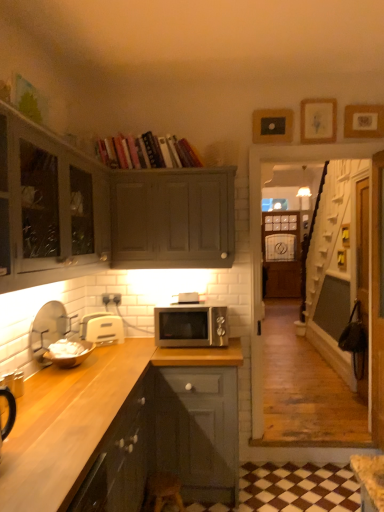
Question: Does silver metallic microwave at center, which is the first appliance from right to left, have a smaller size compared to wooden picture frame at upper center, which is counted as the 2th picture frame, starting from the right?

Choices:
 (A) yes
 (B) no

Answer: (B)

Question: Considering the relative sizes of silver metallic microwave at center, the fourth appliance in the left-to-right sequence, and wooden picture frame at upper center, which appears as the second picture frame when viewed from the left, in the image provided, is silver metallic microwave at center, the fourth appliance in the left-to-right sequence, wider than wooden picture frame at upper center, which appears as the second picture frame when viewed from the left,?

Choices:
 (A) no
 (B) yes

Answer: (B)

Question: Considering the relative sizes of silver metallic microwave at center, which is the first appliance from right to left, and wooden picture frame at upper center, which is counted as the 2th picture frame, starting from the right, in the image provided, is silver metallic microwave at center, which is the first appliance from right to left, thinner than wooden picture frame at upper center, which is counted as the 2th picture frame, starting from the right,?

Choices:
 (A) yes
 (B) no

Answer: (B)

Question: Is silver metallic microwave at center, which is the first appliance from right to left, further to the viewer compared to wooden picture frame at upper center, which is counted as the 2th picture frame, starting from the right?

Choices:
 (A) no
 (B) yes

Answer: (A)

Question: From a real-world perspective, is silver metallic microwave at center, which is the first appliance from right to left, positioned under wooden picture frame at upper center, which is counted as the 2th picture frame, starting from the right, based on gravity?

Choices:
 (A) no
 (B) yes

Answer: (B)

Question: Considering their positions, is hardcover books at upper center located in front of or behind white plastic toaster at lower left, arranged as the second appliance when viewed from the right?

Choices:
 (A) front
 (B) behind

Answer: (A)

Question: Would you say hardcover books at upper center is to the left or to the right of white plastic toaster at lower left, arranged as the second appliance when viewed from the right, in the picture?

Choices:
 (A) left
 (B) right

Answer: (B)

Question: In terms of size, does hardcover books at upper center appear bigger or smaller than white plastic toaster at lower left, which is the third appliance from left to right?

Choices:
 (A) small
 (B) big

Answer: (B)

Question: From the image's perspective, is hardcover books at upper center above or below white plastic toaster at lower left, which is the third appliance from left to right?

Choices:
 (A) above
 (B) below

Answer: (A)

Question: In the image, is silver metallic microwave at center, which is the first appliance from right to left, positioned in front of or behind white matte bowl at left, which ranks as the third appliance in right-to-left order?

Choices:
 (A) behind
 (B) front

Answer: (A)

Question: Based on their positions, is silver metallic microwave at center, which is the first appliance from right to left, located to the left or right of white matte bowl at left, which ranks as the third appliance in right-to-left order?

Choices:
 (A) right
 (B) left

Answer: (A)

Question: Is point (198, 295) positioned closer to the camera than point (46, 354)?

Choices:
 (A) closer
 (B) farther

Answer: (B)

Question: Do you think silver metallic microwave at center, which is the first appliance from right to left, is within white matte bowl at left, the 2th appliance when ordered from left to right, or outside of it?

Choices:
 (A) outside
 (B) inside

Answer: (A)

Question: Visually, is matte gray cabinet at upper center, which ranks as the 3th cabinetry in bottom-to-top order, positioned to the left or to the right of hardcover books at upper center?

Choices:
 (A) left
 (B) right

Answer: (B)

Question: From the image's perspective, is matte gray cabinet at upper center, which ranks as the 3th cabinetry in bottom-to-top order, located above or below hardcover books at upper center?

Choices:
 (A) below
 (B) above

Answer: (A)